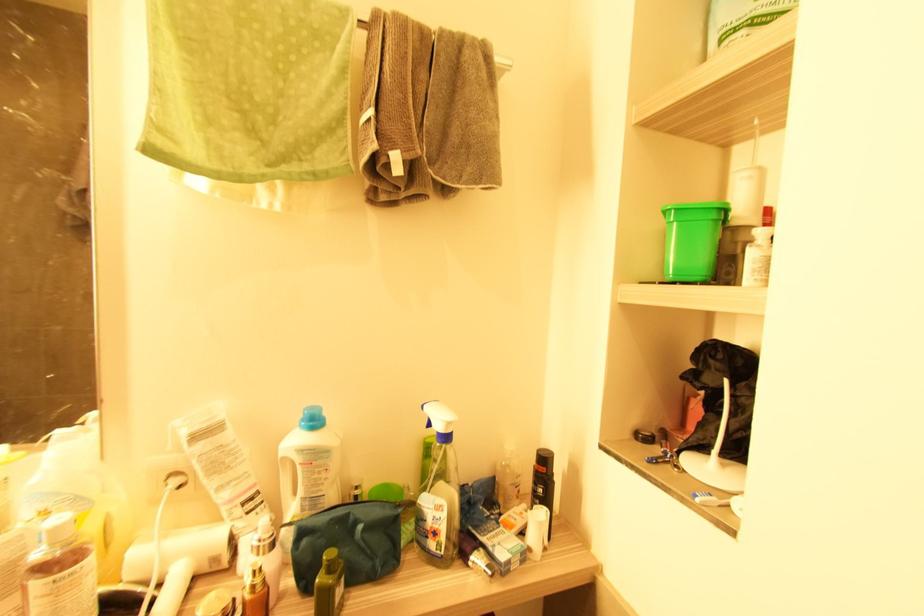
Where would you squeez the spray bottle trigger? Please return your answer as a coordinate pair (x, y).

(440, 419)